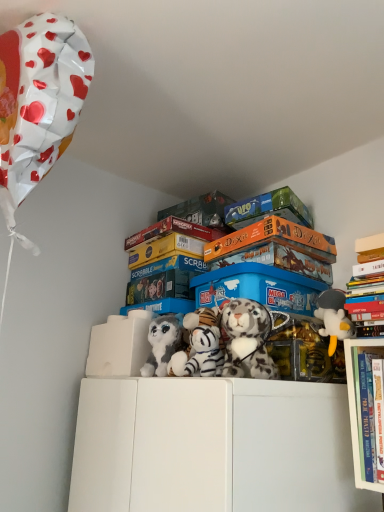
Question: From the image's perspective, is fluffy gray plush at center, which is counted as the 1th toy, starting from the left, above or below white plush tiger at center, the second toy viewed from the left?

Choices:
 (A) above
 (B) below

Answer: (B)

Question: Is fluffy gray plush at center, which is counted as the 1th toy, starting from the left, wider or thinner than white plush tiger at center, the second toy viewed from the left?

Choices:
 (A) thin
 (B) wide

Answer: (A)

Question: Which is nearer to the blue plastic storage box at center?

Choices:
 (A) matt orange board game at upper center, placed as the third book when sorted from right to left
 (B) orange cardboard dixit board game at upper center, which is the 2th book in left-to-right order
 (C) white paper balloon at upper left
 (D) white plush tiger at center, arranged as the 3th toy when viewed from the left
 (E) white plush duck at upper right, which is counted as the 4th toy, starting from the left

Answer: (B)

Question: Estimate the real-world distances between objects in this image. Which object is farther from the hardcover books at upper right?

Choices:
 (A) matt orange board game at upper center, placed as the third book when sorted from right to left
 (B) white paper balloon at upper left
 (C) blue plastic storage box at center
 (D) orange cardboard dixit board game at upper center, which is the 2th book from right to left
 (E) fluffy gray plush at center, which is counted as the 1th toy, starting from the left

Answer: (B)